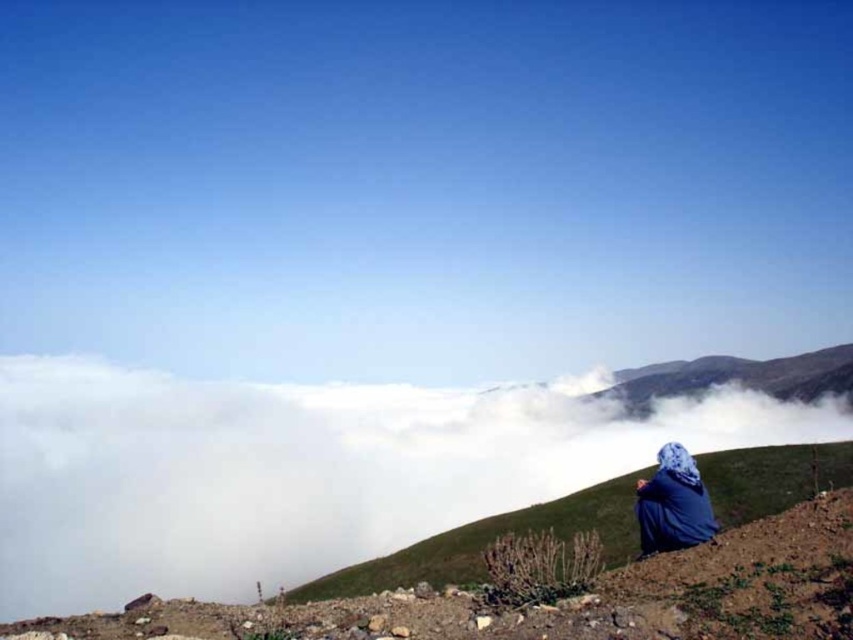
Between point (834, 412) and point (683, 545), which one is positioned behind?

The point (834, 412) is more distant.

Which is in front, point (35, 582) or point (643, 540)?

Point (643, 540)

Measure the distance between white fluffy cloud at upper center and camera.

The distance of white fluffy cloud at upper center from camera is 11.25 meters.

Where is `white fluffy cloud at upper center`? white fluffy cloud at upper center is located at coordinates (300, 470).